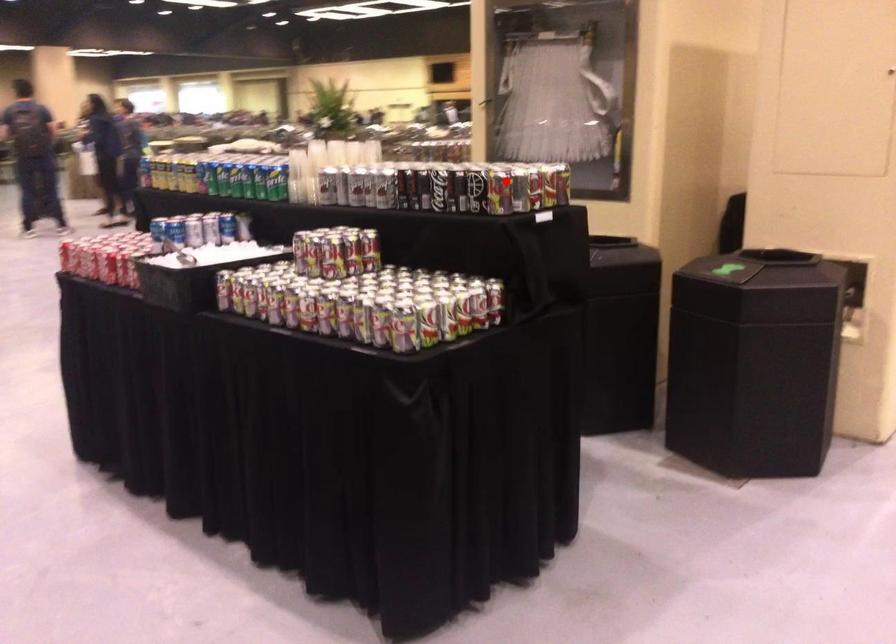
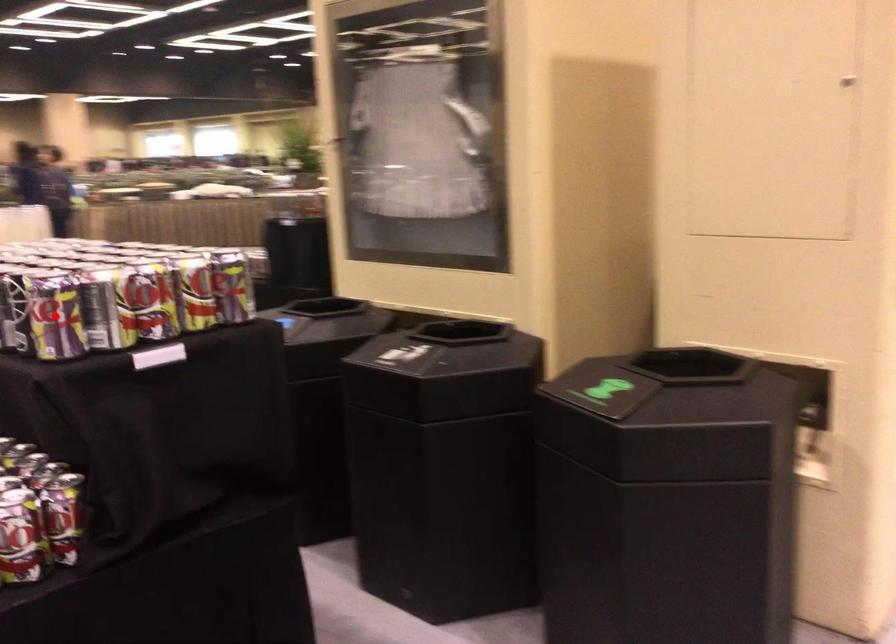
I am providing you with two images of the same scene from different viewpoints. A red point is marked on the first image and another point is marked on the second image. Are the points marked in image1 and image2 representing the same 3D position?

Yes